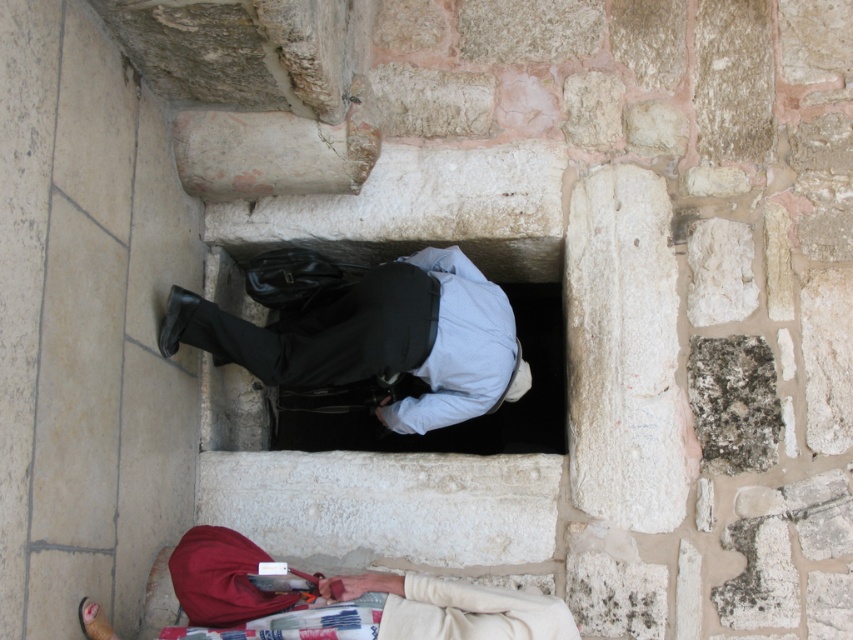
You are a tour guide explaining the historical site to visitors. You notice the light blue fabric shirt at center and the beige fabric bag at lower center in the image. Which object is positioned higher in the scene?

The light blue fabric shirt at center is taller than the beige fabric bag at lower center, so the light blue fabric shirt at center is positioned higher in the scene.

You are a tour guide explaining the historical site to visitors. You notice a light blue fabric shirt at center and a beige fabric bag at lower center in the image. Which object in the scene is bigger?

The light blue fabric shirt at center is larger in size compared to the beige fabric bag at lower center.